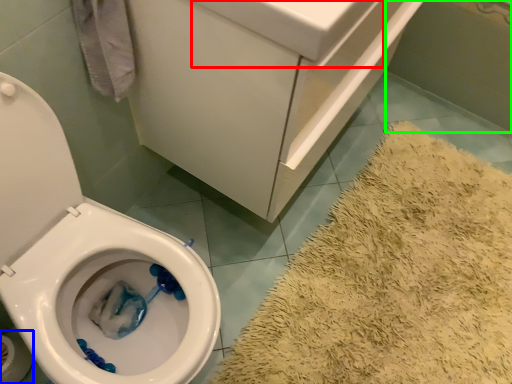
Question: Which object is positioned farthest from sink (highlighted by a red box)? Select from toilet paper (highlighted by a blue box) and bath (highlighted by a green box).

Choices:
 (A) toilet paper
 (B) bath

Answer: (B)